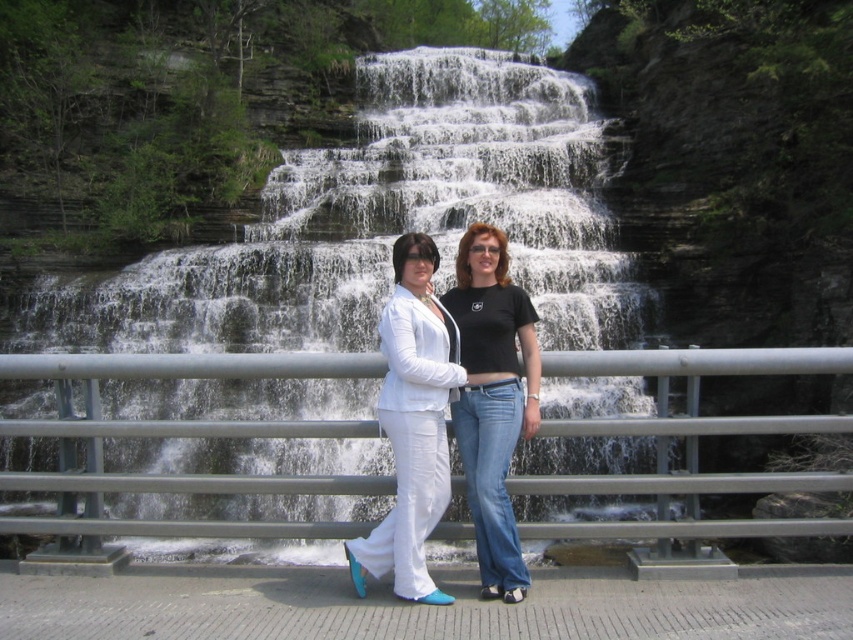
Question: Which point appears closest to the camera in this image?

Choices:
 (A) (426, 488)
 (B) (256, 532)

Answer: (A)

Question: Can you confirm if metallic gray railing at center is positioned below matte white pants at center?

Choices:
 (A) no
 (B) yes

Answer: (B)

Question: Is white textured water at center bigger than matte white pants at center?

Choices:
 (A) yes
 (B) no

Answer: (A)

Question: Which of the following is the closest to the observer?

Choices:
 (A) (312, 225)
 (B) (776, 419)

Answer: (B)

Question: Which object is the closest to the metallic gray railing at center?

Choices:
 (A) white textured water at center
 (B) matte white pants at center

Answer: (B)

Question: Can you confirm if white textured water at center is positioned to the left of matte white pants at center?

Choices:
 (A) yes
 (B) no

Answer: (A)